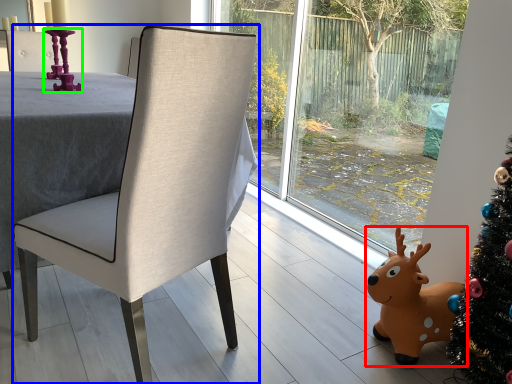
Question: Considering the real-world distances, which object is closest to deer (highlighted by a red box)? chair (highlighted by a blue box) or candle holder (highlighted by a green box).

Choices:
 (A) chair
 (B) candle holder

Answer: (A)